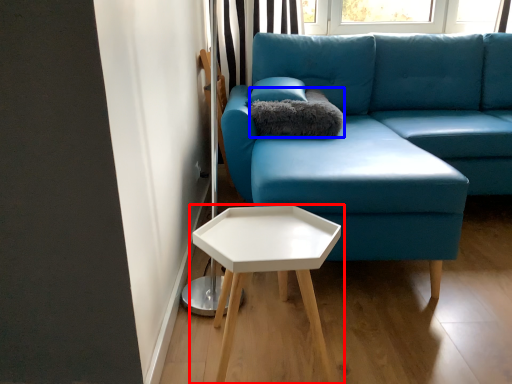
Question: Which object appears closest to the camera in this image, table (highlighted by a red box) or pillow (highlighted by a blue box)?

Choices:
 (A) table
 (B) pillow

Answer: (A)